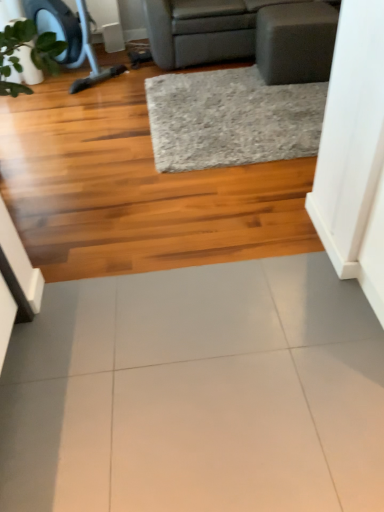
You are a GUI agent. You are given a task and a screenshot of the screen. Output one action in this format:
    pyautogui.click(x=<x>, y=<y>)
    Task: Click on the gray fabric studio couch at upper center
    The image size is (384, 512).
    Given the screenshot: What is the action you would take?
    pyautogui.click(x=245, y=35)

What is the approximate width of white glossy tile at center?

It is 1.01 meters.

Describe the element at coordinates (231, 119) in the screenshot. I see `gray textured rug at center` at that location.

Locate an element on the screen. gray fabric studio couch at upper center is located at coordinates (245, 35).

Which of these two, gray fabric studio couch at upper center or gray textured rug at center, is bigger?

gray fabric studio couch at upper center.

In the image, there is a gray textured rug at center. At what (x,y) coordinates should I click in order to perform the action: click on studio couch above it (from the image's perspective). Please return your answer as a coordinate pair (x, y). The height and width of the screenshot is (512, 384). Looking at the image, I should click on (245, 35).

Is gray fabric studio couch at upper center touching gray textured rug at center?

They are not placed beside each other.

Which is more to the left, gray fabric studio couch at upper center or gray textured rug at center?

gray textured rug at center is more to the left.

Which object is further away from the camera taking this photo, gray textured rug at center or gray fabric studio couch at upper center?

gray fabric studio couch at upper center is more distant.

Is gray textured rug at center wider or thinner than gray fabric studio couch at upper center?

gray textured rug at center is thinner than gray fabric studio couch at upper center.

Is gray textured rug at center facing away from gray fabric studio couch at upper center?

No, gray fabric studio couch at upper center is not at the back of gray textured rug at center.

Who is taller, gray textured rug at center or gray fabric studio couch at upper center?

gray fabric studio couch at upper center is taller.

Considering the sizes of objects white glossy tile at center and gray textured rug at center in the image provided, who is wider, white glossy tile at center or gray textured rug at center?

Wider between the two is gray textured rug at center.

Which is nearer, (22, 466) or (185, 139)?

Point (22, 466) is positioned closer to the camera compared to point (185, 139).

Is white glossy tile at center inside the boundaries of gray textured rug at center, or outside?

white glossy tile at center exists outside the volume of gray textured rug at center.

Is white glossy tile at center next to gray textured rug at center and touching it?

They are not placed beside each other.

Which is in front, gray textured rug at center or white glossy tile at center?

white glossy tile at center is in front.

Which object is positioned more to the left, gray textured rug at center or white glossy tile at center?

white glossy tile at center is more to the left.

Does gray textured rug at center have a larger size compared to white glossy tile at center?

Indeed, gray textured rug at center has a larger size compared to white glossy tile at center.

Which of these two, gray textured rug at center or white glossy tile at center, stands taller?

gray textured rug at center is taller.

Is gray fabric studio couch at upper center looking in the opposite direction of white glossy tile at center?

No, white glossy tile at center is not at the back of gray fabric studio couch at upper center.

From the image's perspective, is gray fabric studio couch at upper center beneath white glossy tile at center?

Actually, gray fabric studio couch at upper center appears above white glossy tile at center in the image.

Can you tell me how much gray fabric studio couch at upper center and white glossy tile at center differ in facing direction?

There is a 176-degree angle between the facing directions of gray fabric studio couch at upper center and white glossy tile at center.

Does gray fabric studio couch at upper center have a smaller size compared to white glossy tile at center?

Actually, gray fabric studio couch at upper center might be larger than white glossy tile at center.

Is gray fabric studio couch at upper center inside white glossy tile at center?

Definitely not — gray fabric studio couch at upper center is not inside white glossy tile at center.

Which object is positioned more to the right, white glossy tile at center or gray fabric studio couch at upper center?

From the viewer's perspective, gray fabric studio couch at upper center appears more on the right side.

Which object is closer to the camera taking this photo, white glossy tile at center or gray fabric studio couch at upper center?

white glossy tile at center.

Locate an element on the screen. The height and width of the screenshot is (512, 384). studio couch located above the gray textured rug at center (from a real-world perspective) is located at coordinates click(245, 35).

Locate an element on the screen. The image size is (384, 512). studio couch above the gray textured rug at center (from the image's perspective) is located at coordinates (245, 35).

In the scene shown: When comparing their distances from gray textured rug at center, does gray fabric studio couch at upper center or white glossy tile at center seem closer?

The object closer to gray textured rug at center is gray fabric studio couch at upper center.

Estimate the real-world distances between objects in this image. Which object is closer to gray textured rug at center, white glossy tile at center or gray fabric studio couch at upper center?

Among the two, gray fabric studio couch at upper center is located nearer to gray textured rug at center.

Considering their positions, is white glossy tile at center positioned closer to gray fabric studio couch at upper center than gray textured rug at center?

The object closer to gray fabric studio couch at upper center is gray textured rug at center.

Estimate the real-world distances between objects in this image. Which object is closer to white glossy tile at center, gray textured rug at center or gray fabric studio couch at upper center?

gray textured rug at center.

Estimate the real-world distances between objects in this image. Which object is further from white glossy tile at center, gray fabric studio couch at upper center or gray textured rug at center?

The object further to white glossy tile at center is gray fabric studio couch at upper center.

Estimate the real-world distances between objects in this image. Which object is further from gray fabric studio couch at upper center, gray textured rug at center or white glossy tile at center?

The object further to gray fabric studio couch at upper center is white glossy tile at center.

Where is `mat that lies between gray fabric studio couch at upper center and white glossy tile at center from top to bottom`? Image resolution: width=384 pixels, height=512 pixels. mat that lies between gray fabric studio couch at upper center and white glossy tile at center from top to bottom is located at coordinates (231, 119).